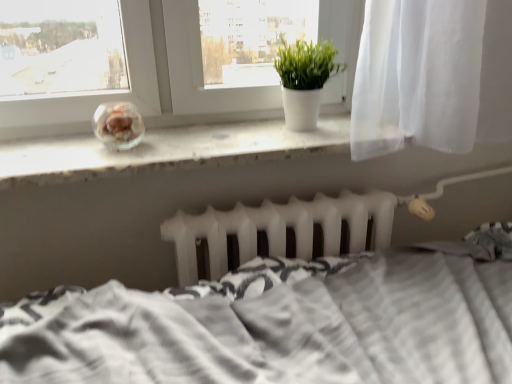
Identify the location of free space to the left of green matte plant at center. (239, 132).